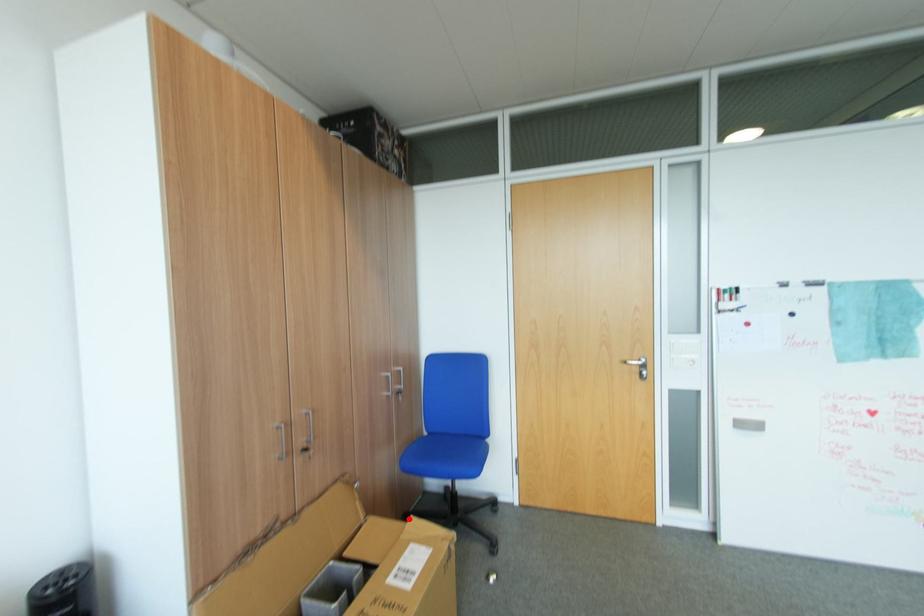
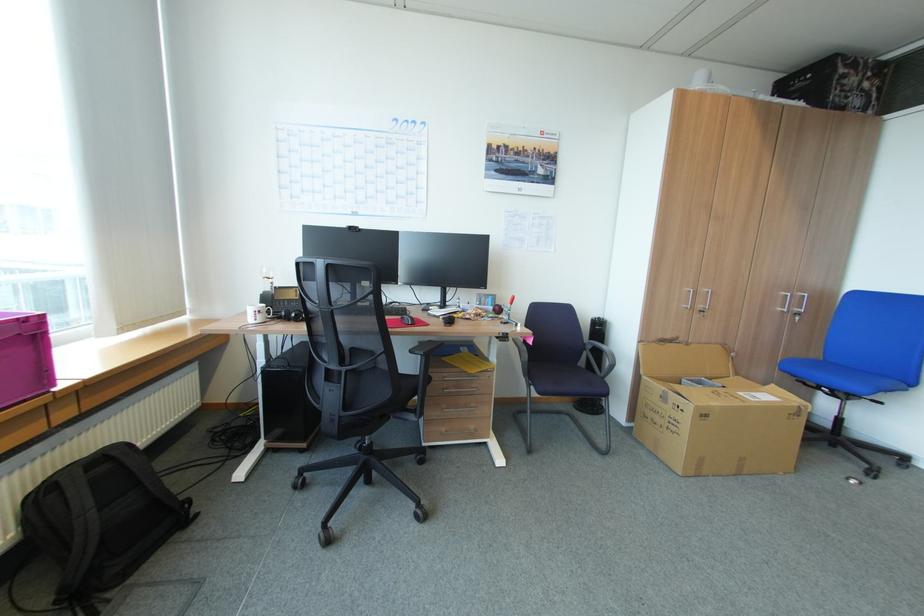
Question: A red point is marked in image1. In image2, is the corresponding 3D point closer to the camera or farther? Reply with the corresponding letter.

Choices:
 (A) The corresponding 3D point is closer.
 (B) The corresponding 3D point is farther.

Answer: (B)